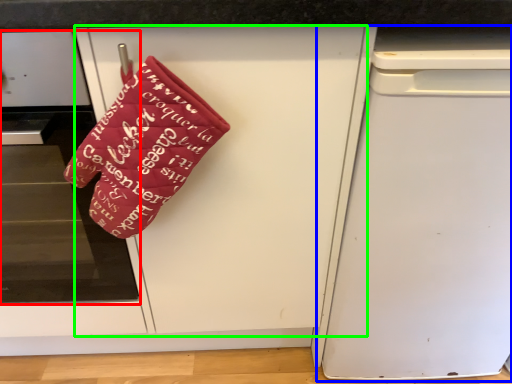
Question: Estimate the real-world distances between objects in this image. Which object is farther from home appliance (highlighted by a red box), dish washer (highlighted by a blue box) or door (highlighted by a green box)?

Choices:
 (A) dish washer
 (B) door

Answer: (A)